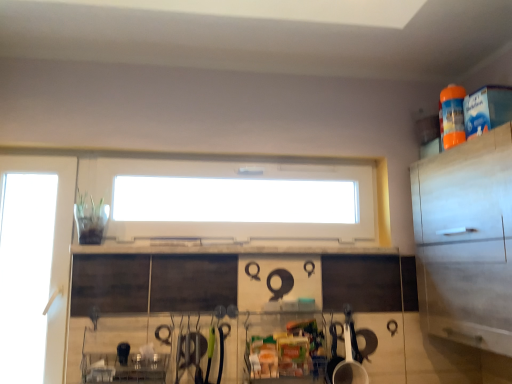
Question: Considering the positions of white glossy cup at lower center and white matte cabinet at right in the image, is white glossy cup at lower center taller or shorter than white matte cabinet at right?

Choices:
 (A) short
 (B) tall

Answer: (A)

Question: Relative to white matte cabinet at right, is white glossy cup at lower center in front or behind?

Choices:
 (A) front
 (B) behind

Answer: (B)

Question: Based on their relative distances, which object is farther from the transparent glass door at left?

Choices:
 (A) white matte cabinet at right
 (B) white glossy cup at lower center
 (C) white plastic window at center

Answer: (C)

Question: Based on their relative distances, which object is farther from the white plastic window at center?

Choices:
 (A) white glossy cup at lower center
 (B) white matte cabinet at right
 (C) transparent glass door at left

Answer: (B)